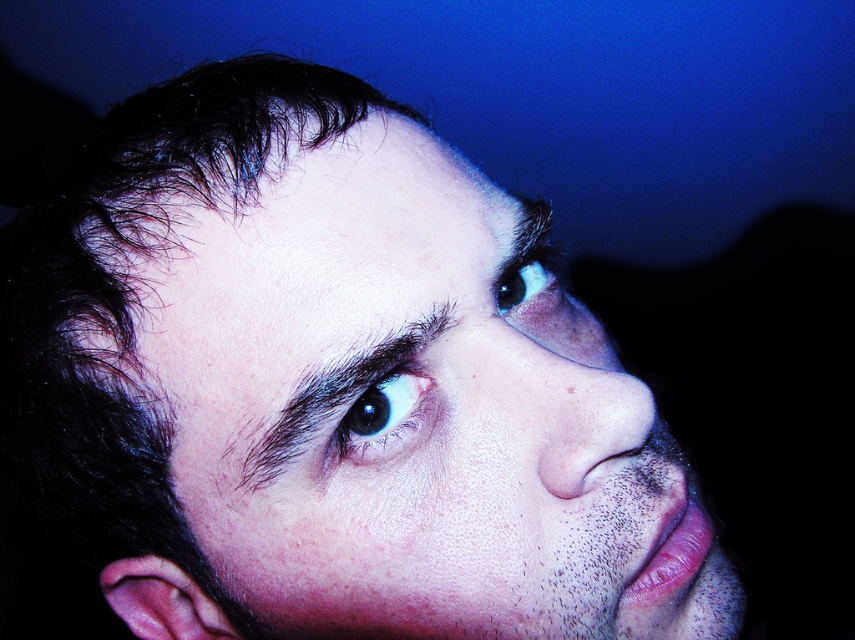
Question: Is smooth skin nose at center to the left of dark brown hair at upper center from the viewer's perspective?

Choices:
 (A) yes
 (B) no

Answer: (B)

Question: Can you confirm if dark brown hair at upper center is positioned below blue glossy eye at upper center?

Choices:
 (A) no
 (B) yes

Answer: (B)

Question: Is smooth skin nose at center to the right of blue glossy eye at upper center from the viewer's perspective?

Choices:
 (A) yes
 (B) no

Answer: (A)

Question: Among these objects, which one is farthest from the camera?

Choices:
 (A) blue glossy eye at upper center
 (B) smooth skin nose at center
 (C) dark brown hair at upper center

Answer: (A)

Question: Which point is closer to the camera?

Choices:
 (A) black glossy eye at center
 (B) blue glossy eye at upper center
 (C) dark brown hair at upper center
 (D) smooth skin nose at center

Answer: (C)

Question: Which of the following is the farthest from the observer?

Choices:
 (A) (517, 291)
 (B) (581, 451)

Answer: (A)